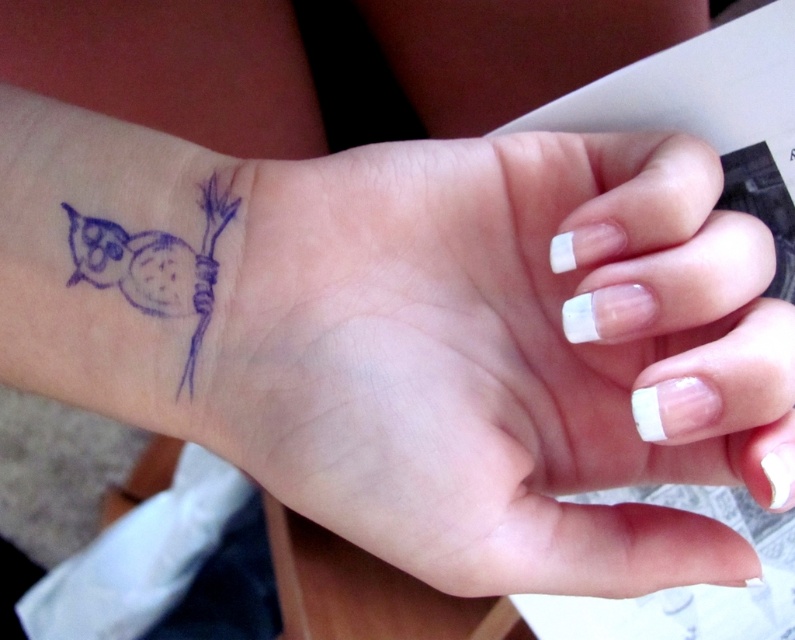
Question: Is matte blue tattoo at upper left below blue ink owl at lower left?

Choices:
 (A) no
 (B) yes

Answer: (B)

Question: Is matte blue tattoo at upper left to the right of blue ink owl at lower left from the viewer's perspective?

Choices:
 (A) yes
 (B) no

Answer: (A)

Question: Which of the following is the closest to the observer?

Choices:
 (A) blue ink owl at lower left
 (B) matte blue tattoo at upper left

Answer: (B)

Question: Which of the following is the farthest from the observer?

Choices:
 (A) (74, 221)
 (B) (284, 328)

Answer: (A)

Question: Can you confirm if matte blue tattoo at upper left is thinner than blue ink owl at lower left?

Choices:
 (A) yes
 (B) no

Answer: (B)